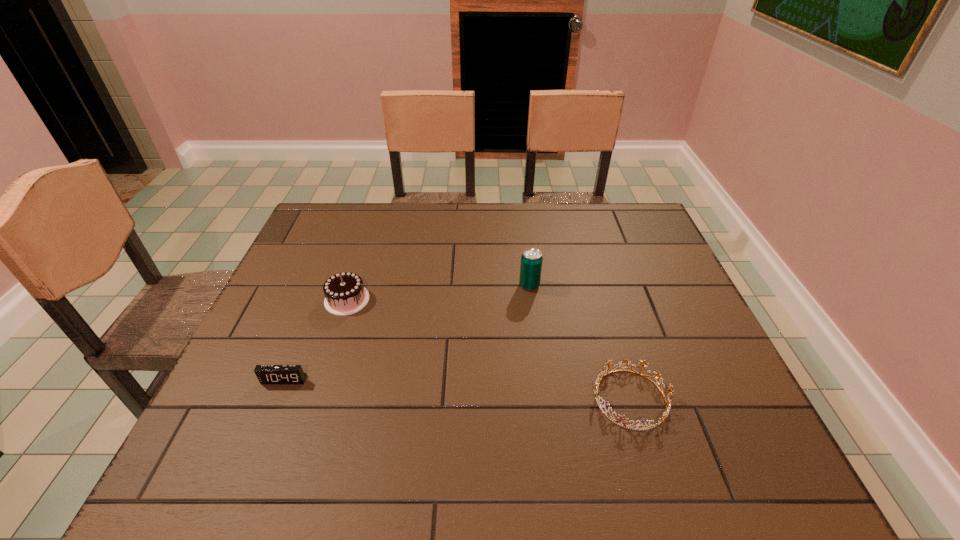
Identify the location of blank region between the tiara and the beer can. The width and height of the screenshot is (960, 540). (580, 342).

Locate an element on the screen. vacant space in between the tiara and the tallest object is located at coordinates (580, 342).

The width and height of the screenshot is (960, 540). I want to click on vacant space that's between the chocolate cake and the second object from right to left, so click(x=438, y=293).

Locate an element on the screen. This screenshot has width=960, height=540. free point between the beer can and the tiara is located at coordinates (580, 342).

Identify the location of free space between the alarm clock and the second tallest object. The width and height of the screenshot is (960, 540). pyautogui.click(x=316, y=340).

Locate an element on the screen. This screenshot has width=960, height=540. free point between the third object from left to right and the alarm clock is located at coordinates (407, 333).

Find the location of a particular element. Image resolution: width=960 pixels, height=540 pixels. free space between the tiara and the tallest object is located at coordinates (580, 342).

Locate an element on the screen. vacant space in between the alarm clock and the chocolate cake is located at coordinates (316, 340).

Image resolution: width=960 pixels, height=540 pixels. What are the coordinates of `free space between the rightmost object and the alarm clock` in the screenshot? It's located at (457, 389).

At what (x,y) coordinates should I click in order to perform the action: click on object that is the third closest to the second tallest object. Please return your answer as a coordinate pair (x, y). The height and width of the screenshot is (540, 960). Looking at the image, I should click on (602, 375).